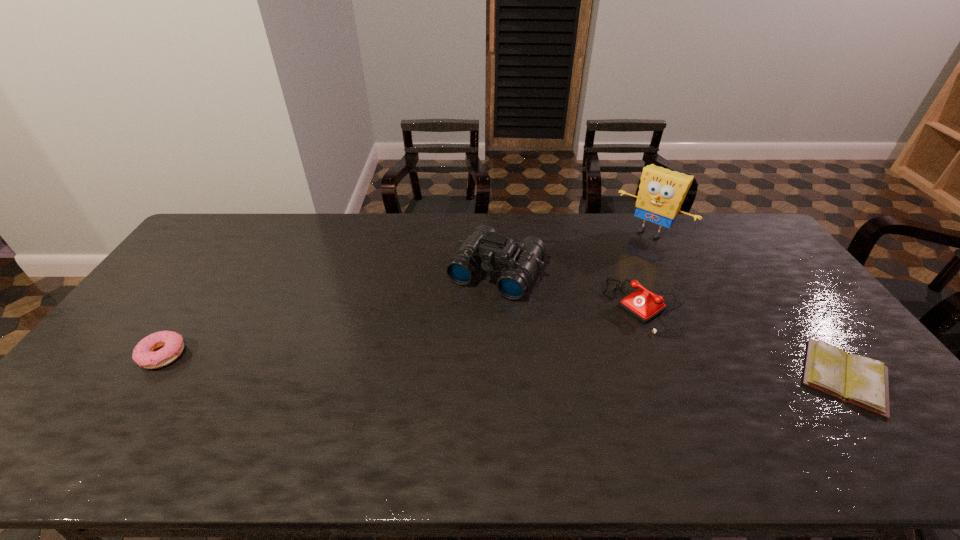
The width and height of the screenshot is (960, 540). Find the location of `sponge present at the far edge`. sponge present at the far edge is located at coordinates (661, 193).

This screenshot has width=960, height=540. What are the coordinates of `object located in the near edge section of the desktop` in the screenshot? It's located at (862, 381).

Locate an element on the screen. This screenshot has width=960, height=540. object that is positioned at the left edge is located at coordinates coord(145,355).

Image resolution: width=960 pixels, height=540 pixels. I want to click on object that is at the right edge, so click(x=862, y=381).

You are a GUI agent. You are given a task and a screenshot of the screen. Output one action in this format:
    pyautogui.click(x=<x>, y=<y>)
    Task: Click on the object located in the near right corner section of the desktop
    
    Given the screenshot: What is the action you would take?
    pyautogui.click(x=862, y=381)

Locate an element on the screen. vacant space at the far edge is located at coordinates (534, 217).

Image resolution: width=960 pixels, height=540 pixels. In order to click on free location at the near edge of the desktop in this screenshot , I will do `click(615, 398)`.

The width and height of the screenshot is (960, 540). I want to click on vacant space at the right edge of the desktop, so click(x=783, y=286).

Where is `free space at the far left corner of the desktop`? free space at the far left corner of the desktop is located at coordinates (239, 237).

Where is `free space at the near left corner of the desktop`? The width and height of the screenshot is (960, 540). free space at the near left corner of the desktop is located at coordinates click(117, 392).